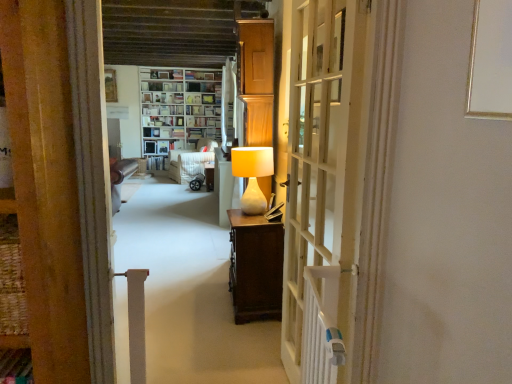
Question: Can we say matte white lamp at center lies outside white wooden door at center?

Choices:
 (A) yes
 (B) no

Answer: (A)

Question: Can you confirm if matte white lamp at center is shorter than white wooden door at center?

Choices:
 (A) no
 (B) yes

Answer: (B)

Question: From a real-world perspective, is matte white lamp at center on white wooden door at center?

Choices:
 (A) yes
 (B) no

Answer: (B)

Question: Is matte white lamp at center in contact with white wooden door at center?

Choices:
 (A) no
 (B) yes

Answer: (A)

Question: From a real-world perspective, is matte white lamp at center positioned under white wooden door at center based on gravity?

Choices:
 (A) yes
 (B) no

Answer: (A)

Question: Is white wooden door at center at the back of matte white lamp at center?

Choices:
 (A) yes
 (B) no

Answer: (B)

Question: From a real-world perspective, is white fabric armchair at center located higher than white wooden door at center?

Choices:
 (A) yes
 (B) no

Answer: (B)

Question: Does white fabric armchair at center have a lesser height compared to white wooden door at center?

Choices:
 (A) yes
 (B) no

Answer: (A)

Question: Does white fabric armchair at center lie behind white wooden door at center?

Choices:
 (A) yes
 (B) no

Answer: (A)

Question: Considering the relative sizes of white fabric armchair at center and white wooden door at center in the image provided, is white fabric armchair at center smaller than white wooden door at center?

Choices:
 (A) yes
 (B) no

Answer: (B)

Question: Could you tell me if white fabric armchair at center is turned towards white wooden door at center?

Choices:
 (A) no
 (B) yes

Answer: (A)

Question: Is white fabric armchair at center not within white wooden door at center?

Choices:
 (A) yes
 (B) no

Answer: (A)

Question: From a real-world perspective, is white wooden door at center positioned under matte white lamp at center based on gravity?

Choices:
 (A) no
 (B) yes

Answer: (A)